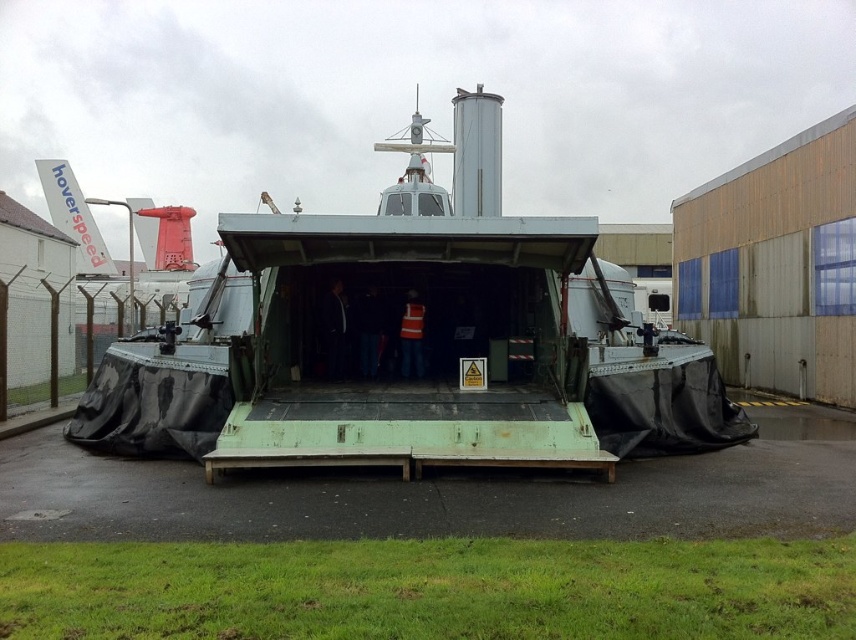
You are a safety inspector checking the hovercraft. You need to ensure that the reflective orange vest at center is visible from a distance. Given that the green matte hovercraft at center is larger, will the vest be easily visible from 50 meters away?

The green matte hovercraft at center is larger than the reflective orange vest at center. Since the vest is smaller and orange against a green background, it should still be visible from 50 meters away due to the color contrast.

You are a safety inspector checking the hovercraft. You need to ensure that the reflective orange vest at center is visible from the side of the green matte hovercraft at center. Given that the hovercraft is wider than the vest, will the vest be fully visible from the side? Please explain.

The green matte hovercraft at center is wider than the reflective orange vest at center. Since the vest is placed at the center of the hovercraft, it will be fully visible from the side as it is positioned within the hovercrafts width.